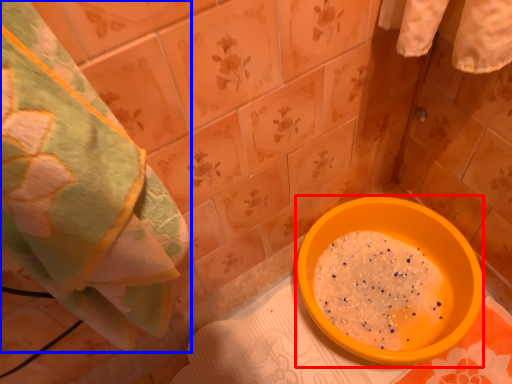
Question: Which object appears closest to the camera in this image, basin (highlighted by a red box) or towel (highlighted by a blue box)?

Choices:
 (A) basin
 (B) towel

Answer: (B)